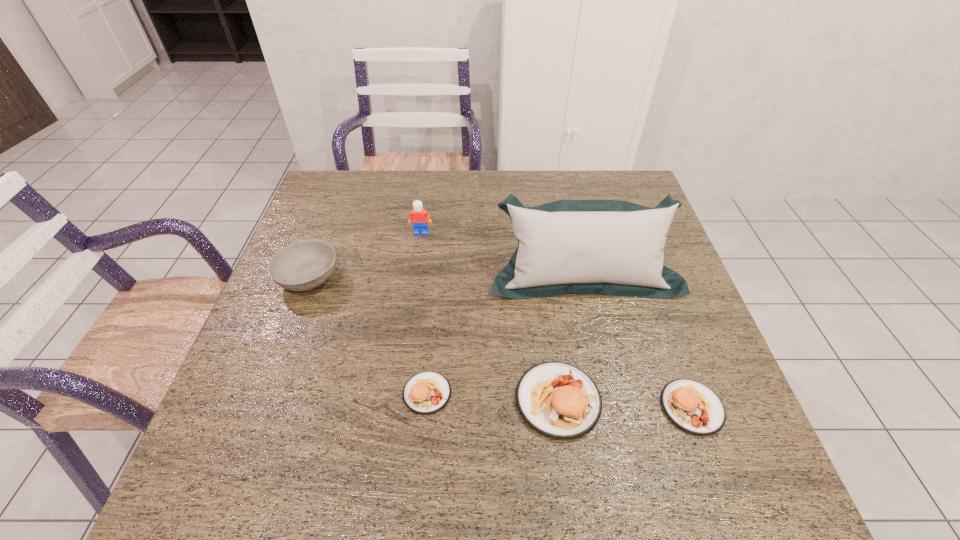
Where is `the shortest object`? This screenshot has height=540, width=960. the shortest object is located at coordinates (427, 392).

The width and height of the screenshot is (960, 540). In order to click on the leftmost patty in this screenshot , I will do `click(427, 392)`.

Image resolution: width=960 pixels, height=540 pixels. In order to click on the second patty from right to left in this screenshot , I will do `click(558, 400)`.

The height and width of the screenshot is (540, 960). What are the coordinates of `the third tallest object` in the screenshot? It's located at (558, 400).

Locate an element on the screen. the rightmost patty is located at coordinates (693, 407).

Where is `Lego`? This screenshot has height=540, width=960. Lego is located at coordinates (419, 217).

You are a GUI agent. You are given a task and a screenshot of the screen. Output one action in this format:
    pyautogui.click(x=<x>, y=<y>)
    Task: Click on the farthest object
    The image size is (960, 540).
    Given the screenshot: What is the action you would take?
    pyautogui.click(x=419, y=217)

This screenshot has width=960, height=540. What are the coordinates of `the tallest object` in the screenshot? It's located at (610, 247).

Where is `the leftmost object`? This screenshot has width=960, height=540. the leftmost object is located at coordinates (301, 266).

The width and height of the screenshot is (960, 540). In order to click on free region located 0.300m on the back of the shortest object in this screenshot , I will do `click(438, 273)`.